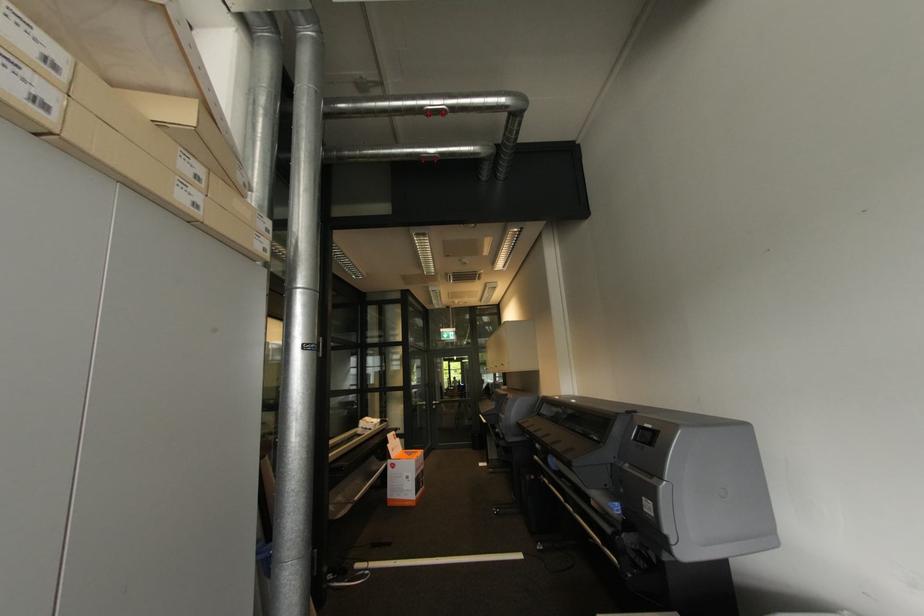
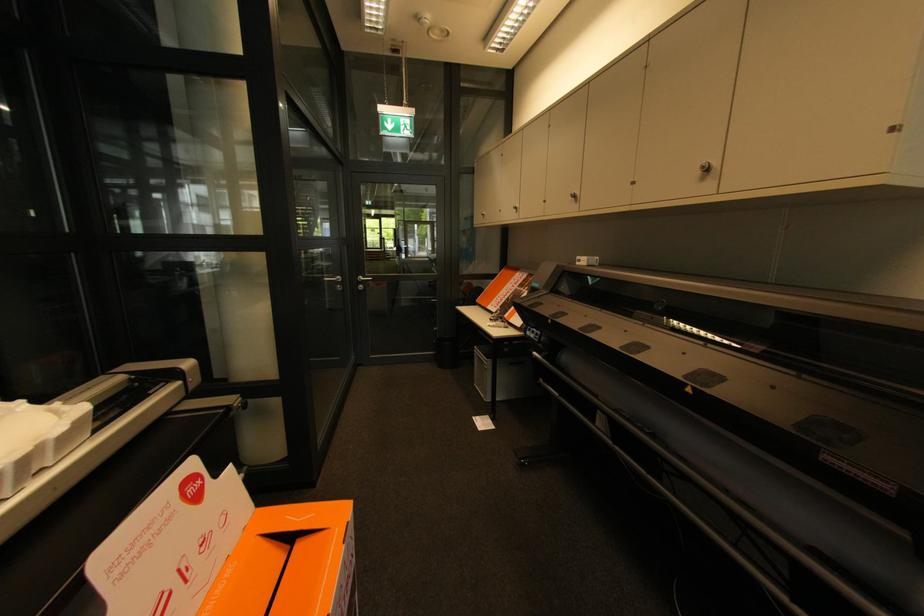
Find the pixel in the second image that matches [438,407] in the first image.

(365, 286)